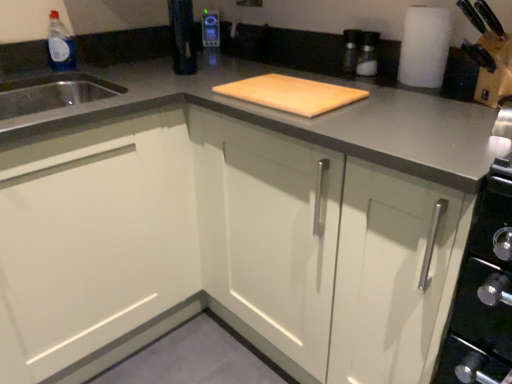
Question: Which direction should I rotate to face white matte cabinet at center, marked as the first cabinetry in a right-to-left arrangement, — up or down?

Choices:
 (A) down
 (B) up

Answer: (A)

Question: Would you say transparent plastic bottle at upper left is a long distance from metallic silver toaster at upper center?

Choices:
 (A) no
 (B) yes

Answer: (A)

Question: Is transparent plastic bottle at upper left surrounding metallic silver toaster at upper center?

Choices:
 (A) no
 (B) yes

Answer: (A)

Question: Is transparent plastic bottle at upper left in front of metallic silver toaster at upper center?

Choices:
 (A) yes
 (B) no

Answer: (A)

Question: Can you confirm if transparent plastic bottle at upper left is smaller than metallic silver toaster at upper center?

Choices:
 (A) no
 (B) yes

Answer: (A)

Question: Does transparent plastic bottle at upper left turn towards metallic silver toaster at upper center?

Choices:
 (A) yes
 (B) no

Answer: (B)

Question: Would you say transparent plastic bottle at upper left is outside metallic silver toaster at upper center?

Choices:
 (A) yes
 (B) no

Answer: (A)

Question: From a real-world perspective, is white matte cabinet at left, the first cabinetry viewed from the left, on top of metallic silver toaster at upper center?

Choices:
 (A) no
 (B) yes

Answer: (A)

Question: Considering the relative sizes of white matte cabinet at left, placed as the second cabinetry when sorted from right to left, and metallic silver toaster at upper center in the image provided, is white matte cabinet at left, placed as the second cabinetry when sorted from right to left, smaller than metallic silver toaster at upper center?

Choices:
 (A) yes
 (B) no

Answer: (B)

Question: Is white matte cabinet at left, placed as the second cabinetry when sorted from right to left, not within metallic silver toaster at upper center?

Choices:
 (A) yes
 (B) no

Answer: (A)

Question: Considering the relative sizes of white matte cabinet at left, placed as the second cabinetry when sorted from right to left, and metallic silver toaster at upper center in the image provided, is white matte cabinet at left, placed as the second cabinetry when sorted from right to left, wider than metallic silver toaster at upper center?

Choices:
 (A) no
 (B) yes

Answer: (B)

Question: Is metallic silver toaster at upper center at the back of white matte cabinet at left, placed as the second cabinetry when sorted from right to left?

Choices:
 (A) yes
 (B) no

Answer: (A)

Question: Considering the relative sizes of white matte cabinet at left, placed as the second cabinetry when sorted from right to left, and metallic silver toaster at upper center in the image provided, is white matte cabinet at left, placed as the second cabinetry when sorted from right to left, shorter than metallic silver toaster at upper center?

Choices:
 (A) no
 (B) yes

Answer: (A)

Question: Does white matte cabinet at center, marked as the first cabinetry in a right-to-left arrangement, turn towards white matte cabinet at left, placed as the second cabinetry when sorted from right to left?

Choices:
 (A) yes
 (B) no

Answer: (A)